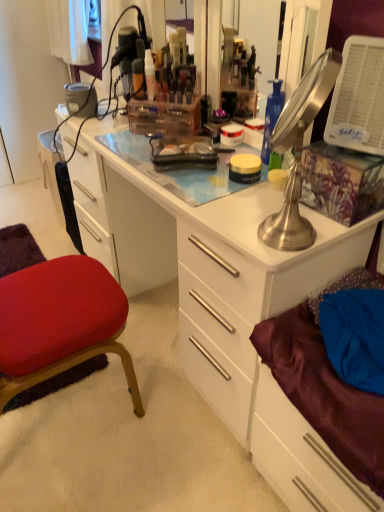
Locate an element on the screen. This screenshot has width=384, height=512. velvet red cushion at lower left is located at coordinates (60, 323).

Image resolution: width=384 pixels, height=512 pixels. Describe the element at coordinates (138, 77) in the screenshot. I see `translucent plastic container at upper center, positioned as the second toiletry in right-to-left order` at that location.

You are a GUI agent. You are given a task and a screenshot of the screen. Output one action in this format:
    pyautogui.click(x=<x>, y=<y>)
    Task: Click on the translucent plastic container at upper center, the 2th toiletry when ordered from left to right
    Image resolution: width=384 pixels, height=512 pixels.
    Given the screenshot: What is the action you would take?
    pyautogui.click(x=149, y=75)

Find the location of a particular element. velvet red cushion at lower left is located at coordinates (60, 323).

Considering their positions, is velvet red cushion at lower left located in front of or behind metallic silver lamp at upper right?

Visually, velvet red cushion at lower left is located behind metallic silver lamp at upper right.

Considering the positions of point (139, 412) and point (331, 57), is point (139, 412) closer or farther from the camera than point (331, 57)?

Clearly, point (139, 412) is more distant from the camera than point (331, 57).

Is velvet red cushion at lower left not inside metallic silver lamp at upper right?

Yes.

Is velvet red cushion at lower left thinner than metallic silver lamp at upper right?

In fact, velvet red cushion at lower left might be wider than metallic silver lamp at upper right.

Is metallic silver lamp at upper right shorter than satin purple drawer at lower right?

Correct, metallic silver lamp at upper right is not as tall as satin purple drawer at lower right.

Does point (280, 120) come closer to viewer compared to point (269, 479)?

Yes.

Based on the photo, can you tell me how much metallic silver lamp at upper right and satin purple drawer at lower right differ in facing direction?

The angle between the facing direction of metallic silver lamp at upper right and the facing direction of satin purple drawer at lower right is 46.5 degrees.

Between translucent plastic container at upper center, acting as the first toiletry starting from the left, and white glossy desk at center, which one has larger width?

Wider between the two is white glossy desk at center.

Which of these two, translucent plastic container at upper center, positioned as the second toiletry in right-to-left order, or white glossy desk at center, stands taller?

With more height is white glossy desk at center.

Can you confirm if translucent plastic container at upper center, acting as the first toiletry starting from the left, is smaller than white glossy desk at center?

Indeed, translucent plastic container at upper center, acting as the first toiletry starting from the left, has a smaller size compared to white glossy desk at center.

Between point (142, 75) and point (266, 288), which one is positioned behind?

Positioned behind is point (142, 75).

In the scene shown: Considering the positions of objects satin purple drawer at lower right and metallic silver lamp at upper right in the image provided, who is more to the left, satin purple drawer at lower right or metallic silver lamp at upper right?

metallic silver lamp at upper right is more to the left.

Measure the distance between satin purple drawer at lower right and metallic silver lamp at upper right.

satin purple drawer at lower right is 21.21 inches from metallic silver lamp at upper right.

Are satin purple drawer at lower right and metallic silver lamp at upper right making contact?

No, satin purple drawer at lower right is not next to metallic silver lamp at upper right.

Is satin purple drawer at lower right taller than metallic silver lamp at upper right?

Correct, satin purple drawer at lower right is much taller as metallic silver lamp at upper right.

Is translucent plastic container at upper center, the 2th toiletry when ordered from left to right, facing towards translucent plastic container at upper center, acting as the first toiletry starting from the left?

No, translucent plastic container at upper center, the 2th toiletry when ordered from left to right, is not turned towards translucent plastic container at upper center, acting as the first toiletry starting from the left.

Would you say translucent plastic container at upper center, the 2th toiletry when ordered from left to right, is outside translucent plastic container at upper center, acting as the first toiletry starting from the left?

Absolutely, translucent plastic container at upper center, the 2th toiletry when ordered from left to right, is external to translucent plastic container at upper center, acting as the first toiletry starting from the left.

How many degrees apart are the facing directions of translucent plastic container at upper center, the 2th toiletry when ordered from left to right, and translucent plastic container at upper center, positioned as the second toiletry in right-to-left order?

0.0108 degrees.

Find the location of `toiletry positioned vertically above the translucent plastic container at upper center, positioned as the second toiletry in right-to-left order (from a real-world perspective)`. toiletry positioned vertically above the translucent plastic container at upper center, positioned as the second toiletry in right-to-left order (from a real-world perspective) is located at coordinates (149, 75).

Which point is more distant from viewer, (379, 220) or (287, 131)?

The point (379, 220) is more distant.

Does white glossy desk at center have a greater width compared to metallic silver lamp at upper right?

Answer: Correct, the width of white glossy desk at center exceeds that of metallic silver lamp at upper right.

From a real-world perspective, is white glossy desk at center under metallic silver lamp at upper right?

Indeed, from a real-world perspective, white glossy desk at center is positioned beneath metallic silver lamp at upper right.

Is satin purple drawer at lower right in contact with translucent plastic container at upper center, acting as the first toiletry starting from the left?

No, satin purple drawer at lower right is not beside translucent plastic container at upper center, acting as the first toiletry starting from the left.

Between point (314, 458) and point (139, 73), which one is positioned in front?

The point (314, 458) is closer to the camera.

From a real-world perspective, is satin purple drawer at lower right positioned over translucent plastic container at upper center, positioned as the second toiletry in right-to-left order, based on gravity?

No, from a real-world perspective, satin purple drawer at lower right is not above translucent plastic container at upper center, positioned as the second toiletry in right-to-left order.

Identify the location of lamp on the right of velvet red cushion at lower left. This screenshot has height=512, width=384. (298, 153).

Where is `drawer below the metallic silver lamp at upper right (from the image's perspective)`? drawer below the metallic silver lamp at upper right (from the image's perspective) is located at coordinates (301, 457).

Looking at the image, which one is located closer to satin purple drawer at lower right, translucent plastic container at upper center, the 1th toiletry in the right-to-left sequence, or velvet red cushion at lower left?

velvet red cushion at lower left lies closer to satin purple drawer at lower right than the other object.

From the image, which object appears to be nearer to white glossy desk at center, translucent plastic container at upper center, the 2th toiletry when ordered from left to right, or velvet red cushion at lower left?

Among the two, velvet red cushion at lower left is located nearer to white glossy desk at center.

Which object lies nearer to the anchor point white glossy desk at center, velvet red cushion at lower left or translucent plastic container at upper center, the 2th toiletry when ordered from left to right?

velvet red cushion at lower left is positioned closer to the anchor white glossy desk at center.

Considering their positions, is translucent plastic container at upper center, the 2th toiletry when ordered from left to right, positioned further to satin purple drawer at lower right than metallic silver lamp at upper right?

translucent plastic container at upper center, the 2th toiletry when ordered from left to right, lies further to satin purple drawer at lower right than the other object.

From the image, which object appears to be nearer to translucent plastic container at upper center, acting as the first toiletry starting from the left, translucent plastic container at upper center, the 2th toiletry when ordered from left to right, or velvet red cushion at lower left?

Based on the image, translucent plastic container at upper center, the 2th toiletry when ordered from left to right, appears to be nearer to translucent plastic container at upper center, acting as the first toiletry starting from the left.

From the image, which object appears to be farther from white glossy desk at center, translucent plastic container at upper center, acting as the first toiletry starting from the left, or metallic silver lamp at upper right?

The object further to white glossy desk at center is translucent plastic container at upper center, acting as the first toiletry starting from the left.

When comparing their distances from satin purple drawer at lower right, does metallic silver lamp at upper right or white glossy desk at center seem closer?

white glossy desk at center is closer to satin purple drawer at lower right.

Consider the image. Which object lies nearer to the anchor point metallic silver lamp at upper right, satin purple drawer at lower right or translucent plastic container at upper center, positioned as the second toiletry in right-to-left order?

Among the two, satin purple drawer at lower right is located nearer to metallic silver lamp at upper right.

Locate an element on the screen. The height and width of the screenshot is (512, 384). desk between metallic silver lamp at upper right and translucent plastic container at upper center, the 2th toiletry when ordered from left to right, in the front-back direction is located at coordinates (209, 273).

This screenshot has width=384, height=512. What are the coordinates of `desk between metallic silver lamp at upper right and satin purple drawer at lower right in the up-down direction` in the screenshot? It's located at (209, 273).

Locate an element on the screen. This screenshot has height=512, width=384. lamp located between velvet red cushion at lower left and satin purple drawer at lower right in the left-right direction is located at coordinates pyautogui.click(x=298, y=153).

Where is `toiletry between translucent plastic container at upper center, the 1th toiletry in the right-to-left sequence, and velvet red cushion at lower left from top to bottom`? toiletry between translucent plastic container at upper center, the 1th toiletry in the right-to-left sequence, and velvet red cushion at lower left from top to bottom is located at coordinates 138,77.